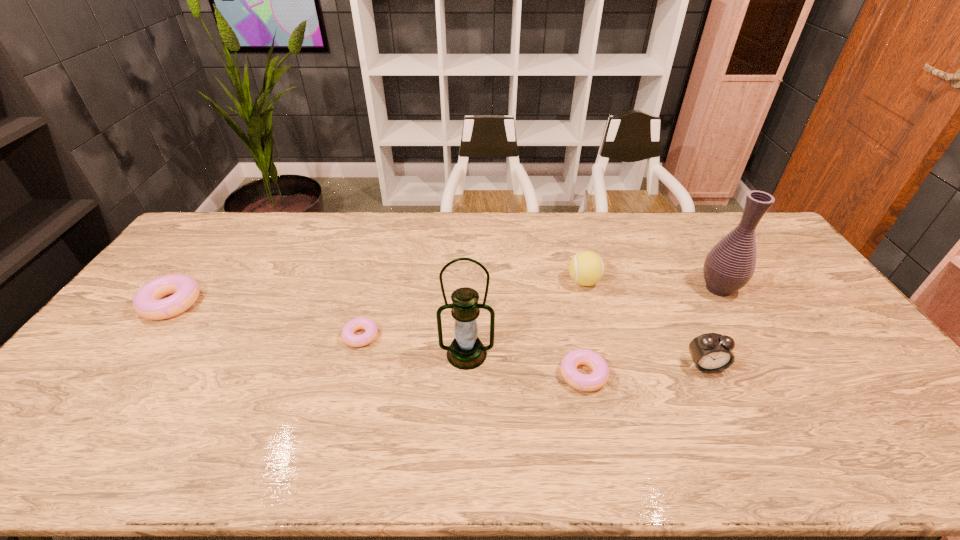
Locate an element on the screen. The width and height of the screenshot is (960, 540). the leftmost object is located at coordinates (146, 303).

Locate an element on the screen. the third shortest object is located at coordinates (146, 303).

What are the coordinates of `the sixth object from right to left` in the screenshot? It's located at (348, 336).

Identify the location of the shortest object. (348, 336).

The height and width of the screenshot is (540, 960). What are the coordinates of `the nearest doughnut` in the screenshot? It's located at (585, 382).

Where is `the rightmost doughnut`? The image size is (960, 540). the rightmost doughnut is located at coordinates (585, 382).

In order to click on vase in this screenshot , I will do `click(730, 265)`.

Find the location of `tennis ball`. tennis ball is located at coordinates (586, 268).

At what (x,y) coordinates should I click in order to perform the action: click on the second object from right to left. Please return your answer as a coordinate pair (x, y). The image size is (960, 540). Looking at the image, I should click on (711, 352).

At what (x,y) coordinates should I click in order to perform the action: click on the fifth object from right to left. Please return your answer as a coordinate pair (x, y). Looking at the image, I should click on (466, 352).